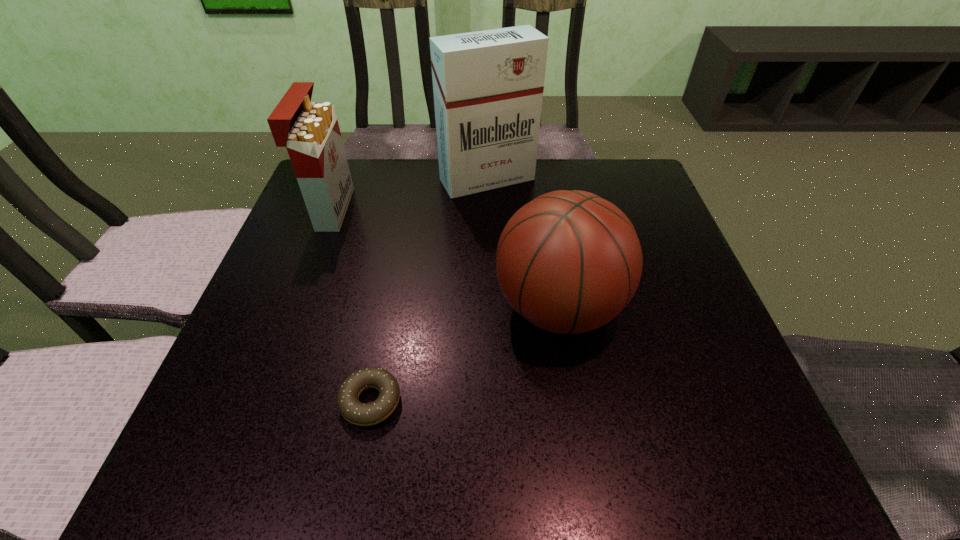
Identify the location of vacant space located on the back of the nearest object. The image size is (960, 540). (386, 319).

In order to click on object that is at the near edge in this screenshot , I will do `click(355, 412)`.

Identify the location of object located in the left edge section of the desktop. This screenshot has height=540, width=960. (310, 131).

Find the location of `object at the right edge`. object at the right edge is located at coordinates (568, 261).

Image resolution: width=960 pixels, height=540 pixels. In order to click on object positioned at the far left corner in this screenshot , I will do `click(310, 131)`.

What are the coordinates of `free location at the far edge` in the screenshot? It's located at (436, 163).

The width and height of the screenshot is (960, 540). I want to click on vacant space at the near edge, so click(653, 433).

The height and width of the screenshot is (540, 960). In the image, there is a desktop. In order to click on vacant space at the left edge in this screenshot , I will do `click(341, 230)`.

Where is `vacant space at the right edge`? This screenshot has width=960, height=540. vacant space at the right edge is located at coordinates (663, 239).

This screenshot has height=540, width=960. Find the location of `vacant space at the far right corner`. vacant space at the far right corner is located at coordinates (639, 160).